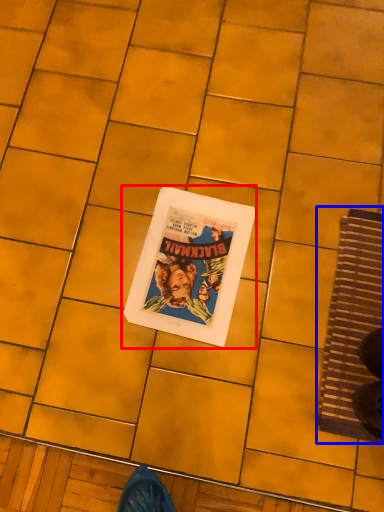
Question: Which object is closer to the camera taking this photo, paperback book (highlighted by a red box) or doormat (highlighted by a blue box)?

Choices:
 (A) paperback book
 (B) doormat

Answer: (B)